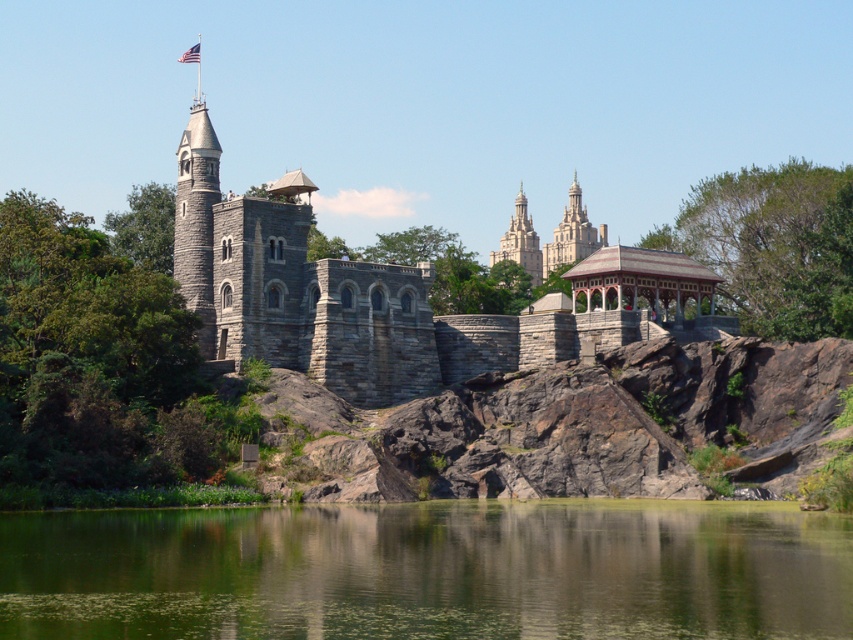
You are a tourist visiting the historic site and want to take a photo that includes both the wooden gazebo at center and the american flag at upper center. Since you want the gazebo to appear larger in the photo, should you move closer to or farther away from the gazebo?

To make the wooden gazebo at center appear larger in the photo compared to the american flag at upper center, you should move closer to the gazebo. Since the wooden gazebo at center is taller than the american flag at upper center, moving closer will emphasize its size relative to the flag.

You are a photographer planning to capture a wide shot of the light gray stone tower at center and the american flag at upper center. If you want to ensure both objects are fully visible in your frame, which object should you prioritize positioning closer to the edge of the frame to avoid cropping?

Since the light gray stone tower at center is wider than the american flag at upper center, you should prioritize positioning the light gray stone tower at center closer to the edge of the frame to avoid cropping, as it requires more space.